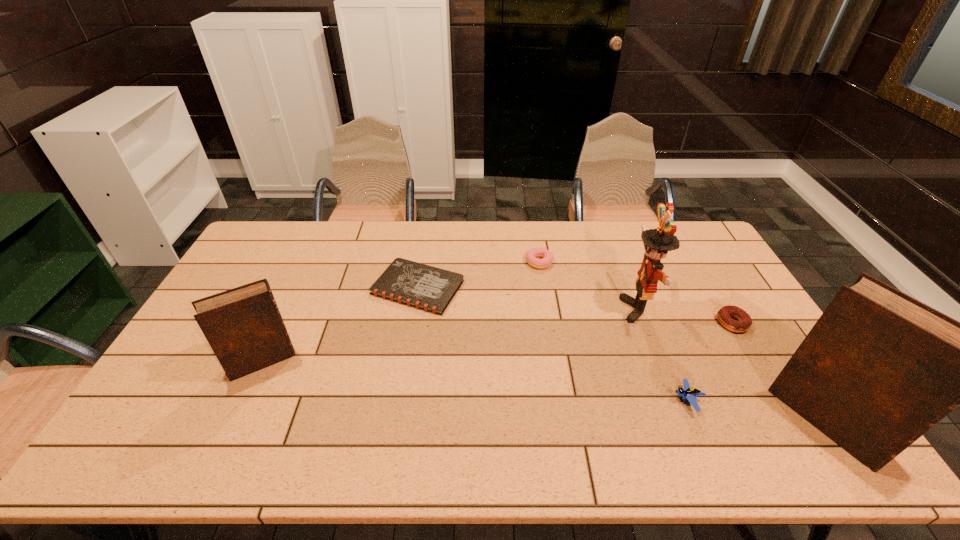
This screenshot has width=960, height=540. What are the coordinates of `free space located on the right of the left Bible` in the screenshot? It's located at (351, 362).

This screenshot has width=960, height=540. What are the coordinates of `free location located on the back of the right Bible` in the screenshot? It's located at (774, 340).

Where is `vacant space located on the left of the right doughnut`? vacant space located on the left of the right doughnut is located at coordinates (602, 323).

At what (x,y) coordinates should I click in order to perform the action: click on free space located 0.230m on the front of the farther doughnut. Please return your answer as a coordinate pair (x, y). Looking at the image, I should click on (548, 319).

Locate an element on the screen. This screenshot has width=960, height=540. free space located 0.230m on the front of the sixth object from right to left is located at coordinates (403, 377).

I want to click on free location located on the front-facing side of the nutcracker, so click(x=524, y=310).

You are a GUI agent. You are given a task and a screenshot of the screen. Output one action in this format:
    pyautogui.click(x=<x>, y=<y>)
    Task: Click on the free location located 0.160m on the front-facing side of the nutcracker
    
    Given the screenshot: What is the action you would take?
    pyautogui.click(x=572, y=310)

You are a GUI agent. You are given a task and a screenshot of the screen. Output one action in this format:
    pyautogui.click(x=<x>, y=<y>)
    Task: Click on the blank space located 0.350m on the front-facing side of the nutcracker
    The image size is (960, 540).
    Given the screenshot: What is the action you would take?
    pyautogui.click(x=511, y=310)

Where is `vacant space located on the front-facing side of the fourth tallest object`? Image resolution: width=960 pixels, height=540 pixels. vacant space located on the front-facing side of the fourth tallest object is located at coordinates (618, 401).

Where is `free space located 0.280m on the front-facing side of the fourth tallest object`? free space located 0.280m on the front-facing side of the fourth tallest object is located at coordinates (564, 401).